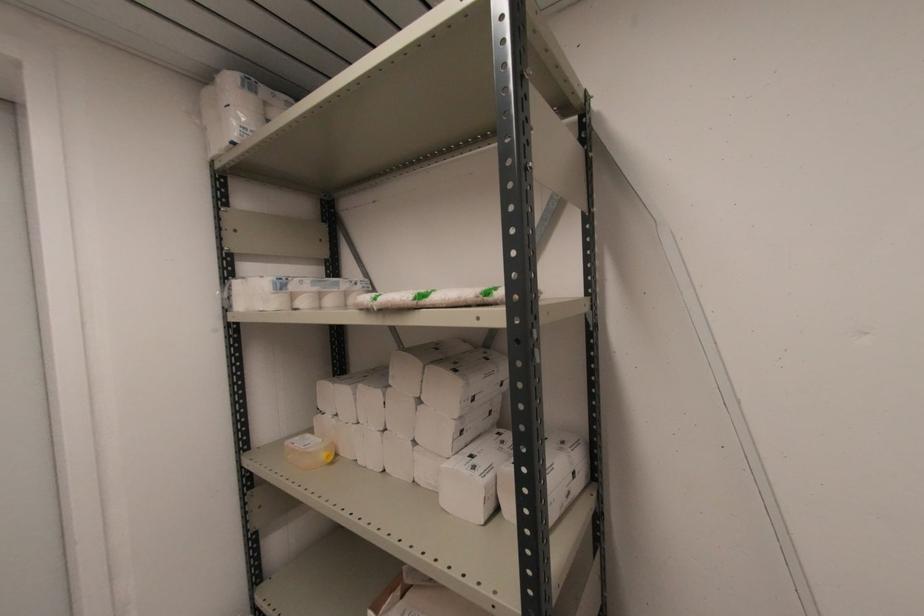
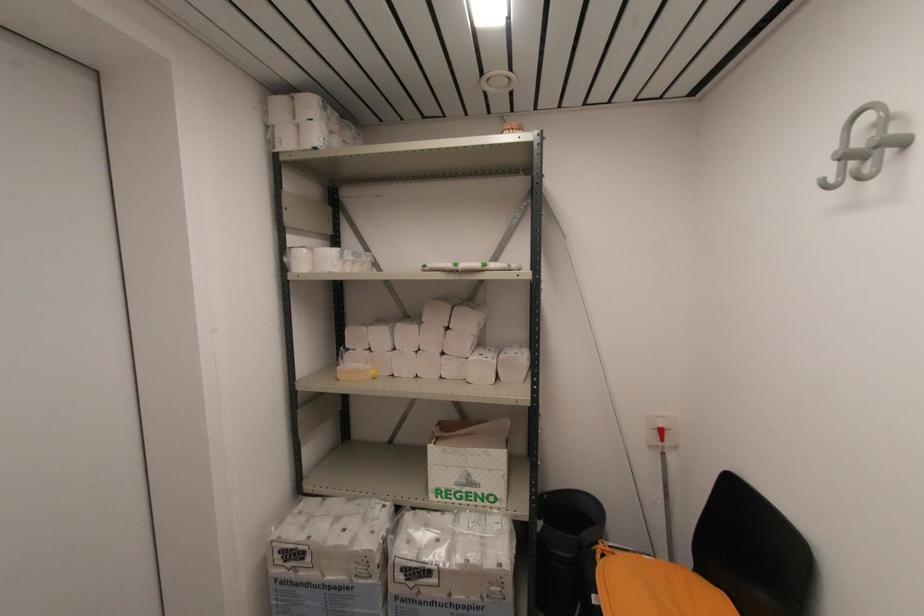
Find the pixel in the second image that matches pixel 312 286 in the first image.

(353, 257)